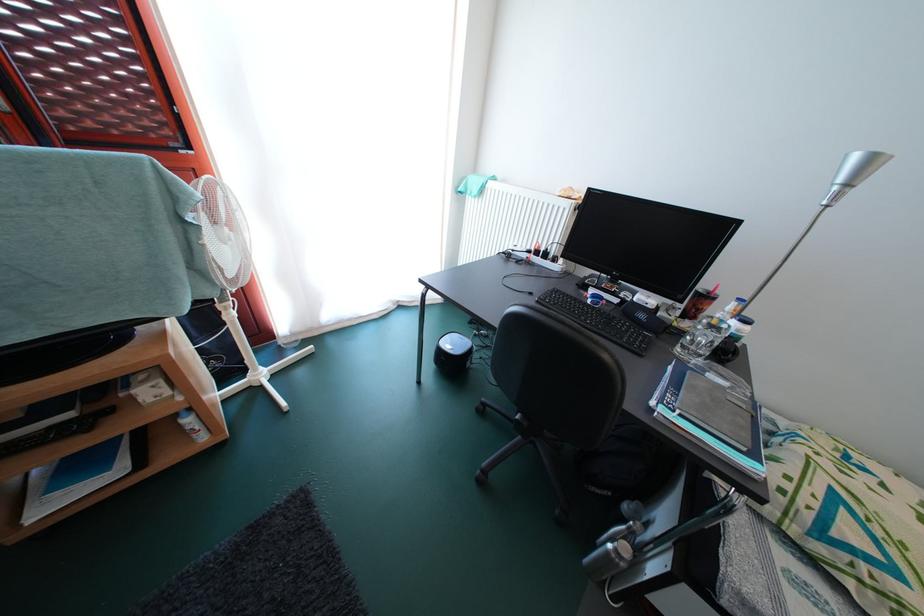
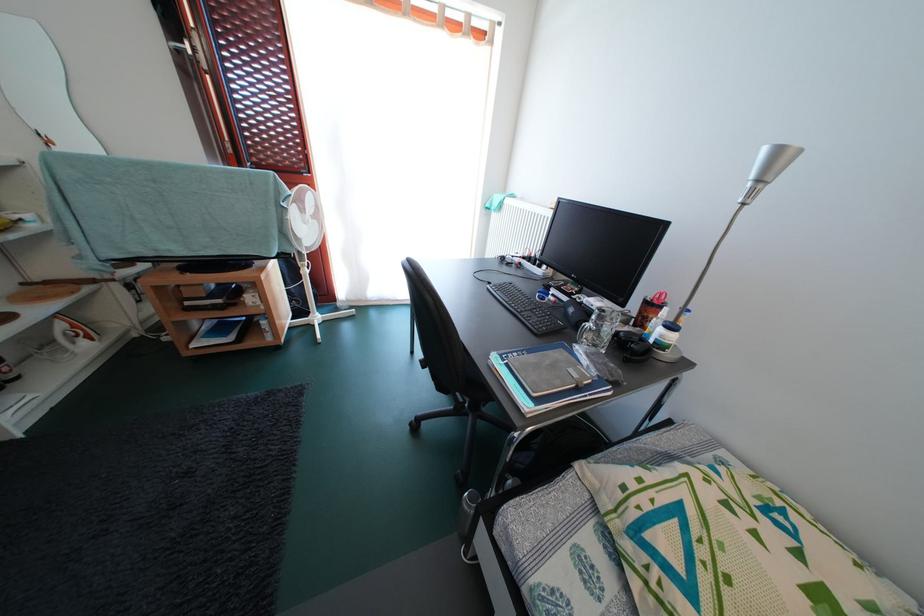
Locate, in the second image, the point that corresponds to pixel 714 304 in the first image.

(658, 310)